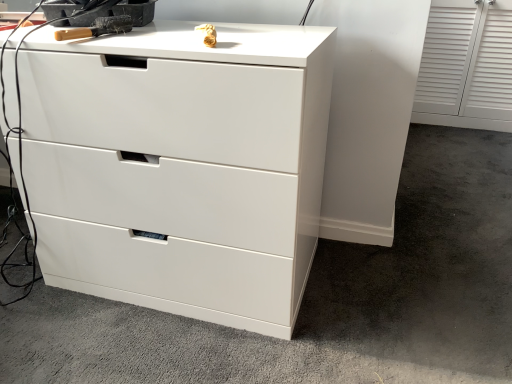
Question: Does white glossy drawer at center turn towards white glossy chest of drawers at center?

Choices:
 (A) yes
 (B) no

Answer: (B)

Question: From a real-world perspective, is white glossy drawer at center over white glossy chest of drawers at center?

Choices:
 (A) yes
 (B) no

Answer: (B)

Question: Are white glossy drawer at center and white glossy chest of drawers at center far apart?

Choices:
 (A) no
 (B) yes

Answer: (A)

Question: Is white glossy chest of drawers at center at the back of white glossy drawer at center?

Choices:
 (A) no
 (B) yes

Answer: (A)

Question: Can you confirm if white glossy drawer at center is shorter than white glossy chest of drawers at center?

Choices:
 (A) no
 (B) yes

Answer: (B)

Question: Based on their sizes in the image, would you say white glossy chest of drawers at center is bigger or smaller than white glossy drawer at center?

Choices:
 (A) big
 (B) small

Answer: (B)

Question: Does point click(106, 240) appear closer or farther from the camera than point click(411, 329)?

Choices:
 (A) closer
 (B) farther

Answer: (A)

Question: Visually, is white glossy chest of drawers at center positioned to the left or to the right of white glossy drawer at center?

Choices:
 (A) left
 (B) right

Answer: (A)

Question: From a real-world perspective, is white glossy chest of drawers at center above or below white glossy drawer at center?

Choices:
 (A) below
 (B) above

Answer: (B)

Question: From a real-world perspective, is white glossy drawer at center above or below white glossy chest of drawers at center?

Choices:
 (A) above
 (B) below

Answer: (B)

Question: Is white glossy drawer at center in front of or behind white glossy chest of drawers at center in the image?

Choices:
 (A) behind
 (B) front

Answer: (B)

Question: Is white glossy drawer at center inside the boundaries of white glossy chest of drawers at center, or outside?

Choices:
 (A) outside
 (B) inside

Answer: (A)

Question: From the image's perspective, is white glossy drawer at center positioned above or below white glossy chest of drawers at center?

Choices:
 (A) below
 (B) above

Answer: (B)

Question: In the image, is wooden-handled brush at upper left on the left side or the right side of white glossy drawer at center?

Choices:
 (A) right
 (B) left

Answer: (B)

Question: In the image, is wooden-handled brush at upper left positioned in front of or behind white glossy drawer at center?

Choices:
 (A) behind
 (B) front

Answer: (A)